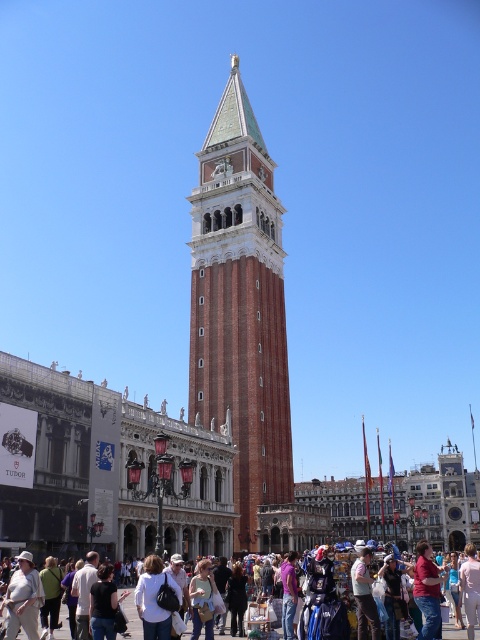
You are a tourist standing at St. Mark Square in Venice. You see the Campanile di San Marco and two groups of people. The first group is wearing a matte pink shirt at center, and the second group is the matte white crowd at lower center. Which group is positioned to the right side of the square?

The matte pink shirt at center is positioned to the right of the matte white crowd at lower center, so the group wearing the matte pink shirt at center is on the right side.

You are standing at the edge of St. Mark Square and want to take a photo of the red brick bell tower at center without the matte white crowd at lower center blocking the view. Which direction should you move to ensure the crowd is out of frame?

Move to the right side because the red brick bell tower at center is to the left of the matte white crowd at lower center, so moving right would position the tower away from the crowd.